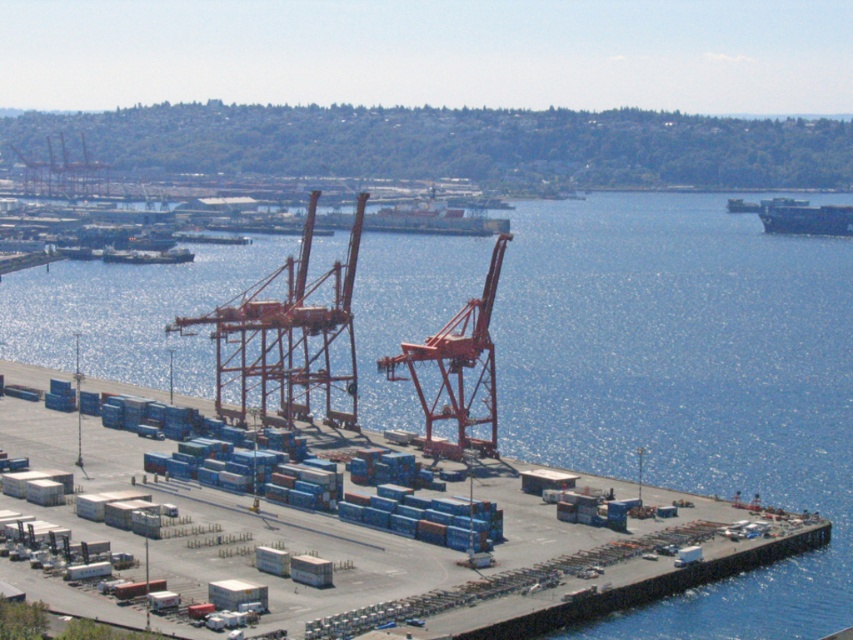
Consider the image. Is blue water at center taller than metallic orange crane at center?

Yes.

Does blue water at center appear over metallic orange crane at center?

No.

Is point (538, 333) in front of point (488, 273)?

Yes.

Find the location of a particular element. The image size is (853, 640). blue water at center is located at coordinates (688, 381).

Is orange metallic crane at upper left below dark gray matte container ship at right?

No.

Can you confirm if orange metallic crane at upper left is taller than dark gray matte container ship at right?

Yes, orange metallic crane at upper left is taller than dark gray matte container ship at right.

Is point (97, 195) closer to camera compared to point (811, 216)?

Yes.

This screenshot has height=640, width=853. In order to click on orange metallic crane at upper left in this screenshot , I will do `click(64, 173)`.

Which is in front, point (358, 234) or point (792, 224)?

Point (358, 234) is in front.

Does orange metallic crane at center have a greater height compared to dark gray matte container ship at right?

Indeed, orange metallic crane at center has a greater height compared to dark gray matte container ship at right.

What do you see at coordinates (286, 340) in the screenshot? This screenshot has width=853, height=640. I see `orange metallic crane at center` at bounding box center [286, 340].

Identify the location of orange metallic crane at center. This screenshot has height=640, width=853. (286, 340).